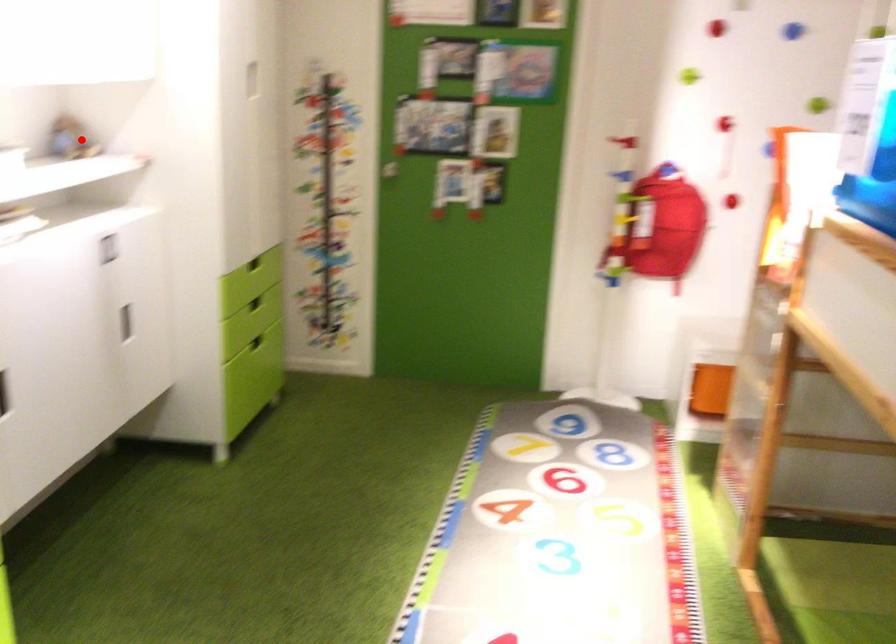
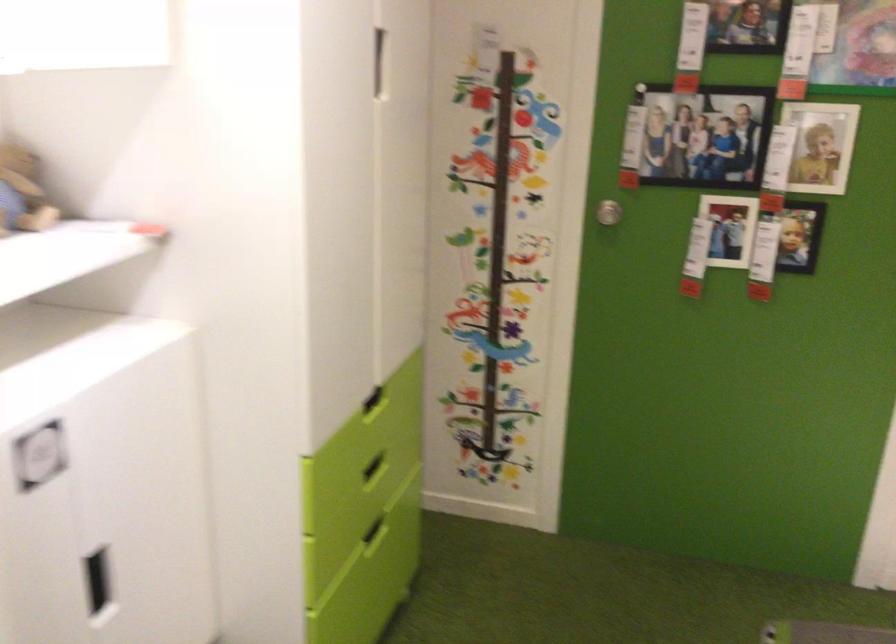
Question: I am providing you with two images of the same scene from different viewpoints. In image1, a red point is highlighted. Considering the same 3D point in image2, which of the following is correct?

Choices:
 (A) It is closer
 (B) It is farther

Answer: (A)